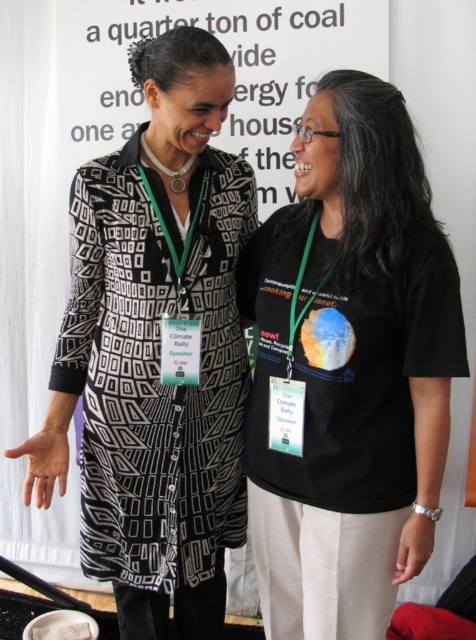
You are a photographer trying to capture a candid shot of the two people in the image. You want to focus on the person closer to the camera. Which of the two points, point (387, 417) or point (201, 436), should you aim your camera at to ensure the person is in focus?

Point (387, 417) is closer to the viewer than point (201, 436), so you should aim your camera at point (387, 417) to focus on the person closer to the camera.